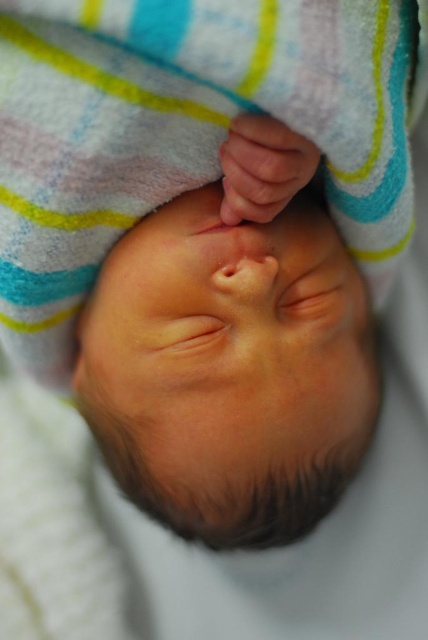
You are a photographer taking a close up of a newborn baby. You need to focus on the smooth skin head at center and the smooth skin hand at upper center. Which object should you focus on first to ensure proper depth of field?

The smooth skin head at center should be focused on first because it is closer to the viewer than the smooth skin hand at upper center, ensuring proper depth of field.

Looking at the newborn baby in the image, which object has a larger size between the smooth skin head at center and the smooth skin hand at upper center?

The smooth skin head at center is bigger than the smooth skin hand at upper center.